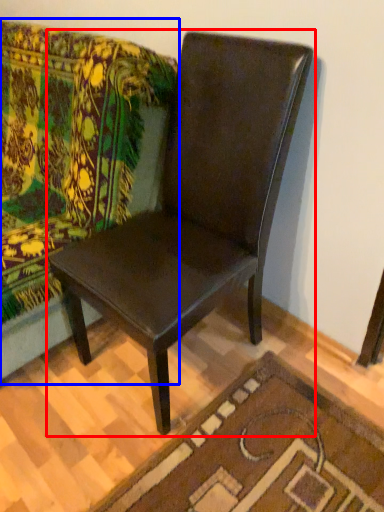
Question: Which object is closer to the camera taking this photo, chair (highlighted by a red box) or studio couch (highlighted by a blue box)?

Choices:
 (A) chair
 (B) studio couch

Answer: (A)